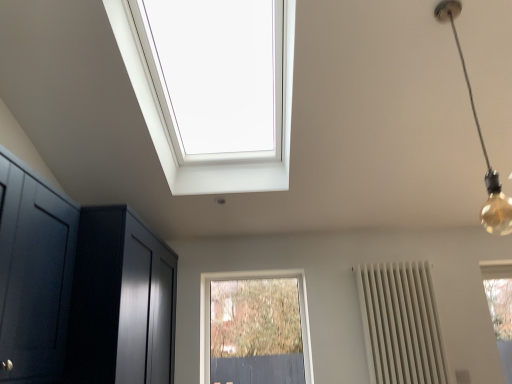
Question: Does white matte radiator at right turn towards gold bulb at upper right?

Choices:
 (A) yes
 (B) no

Answer: (A)

Question: Does white matte radiator at right have a smaller size compared to gold bulb at upper right?

Choices:
 (A) no
 (B) yes

Answer: (A)

Question: Are white matte radiator at right and gold bulb at upper right far apart?

Choices:
 (A) yes
 (B) no

Answer: (B)

Question: Does white matte radiator at right have a lesser height compared to gold bulb at upper right?

Choices:
 (A) no
 (B) yes

Answer: (B)

Question: Can you confirm if white matte radiator at right is positioned to the left of gold bulb at upper right?

Choices:
 (A) yes
 (B) no

Answer: (B)

Question: Would you say glossy dark wood dresser at left is to the left or to the right of gold bulb at upper right in the picture?

Choices:
 (A) left
 (B) right

Answer: (A)

Question: From the image's perspective, is glossy dark wood dresser at left positioned above or below gold bulb at upper right?

Choices:
 (A) below
 (B) above

Answer: (A)

Question: In terms of width, does glossy dark wood dresser at left look wider or thinner when compared to gold bulb at upper right?

Choices:
 (A) thin
 (B) wide

Answer: (B)

Question: Does point (117, 261) appear closer or farther from the camera than point (450, 21)?

Choices:
 (A) closer
 (B) farther

Answer: (B)

Question: Considering the positions of white matte radiator at right and clear glass window at center in the image, is white matte radiator at right taller or shorter than clear glass window at center?

Choices:
 (A) short
 (B) tall

Answer: (B)

Question: Does point (393, 370) appear closer or farther from the camera than point (286, 271)?

Choices:
 (A) closer
 (B) farther

Answer: (A)

Question: From a real-world perspective, is white matte radiator at right physically located above or below clear glass window at center?

Choices:
 (A) below
 (B) above

Answer: (B)

Question: Is white matte radiator at right spatially inside clear glass window at center, or outside of it?

Choices:
 (A) outside
 (B) inside

Answer: (A)

Question: Is glossy dark wood dresser at left in front of or behind white matte radiator at right in the image?

Choices:
 (A) behind
 (B) front

Answer: (B)

Question: Considering the positions of glossy dark wood dresser at left and white matte radiator at right in the image, is glossy dark wood dresser at left bigger or smaller than white matte radiator at right?

Choices:
 (A) big
 (B) small

Answer: (A)